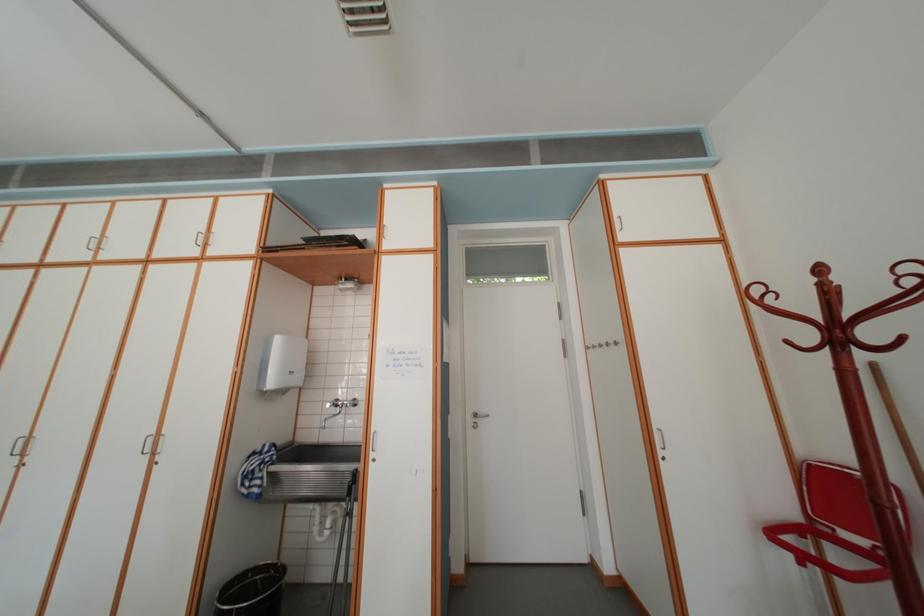
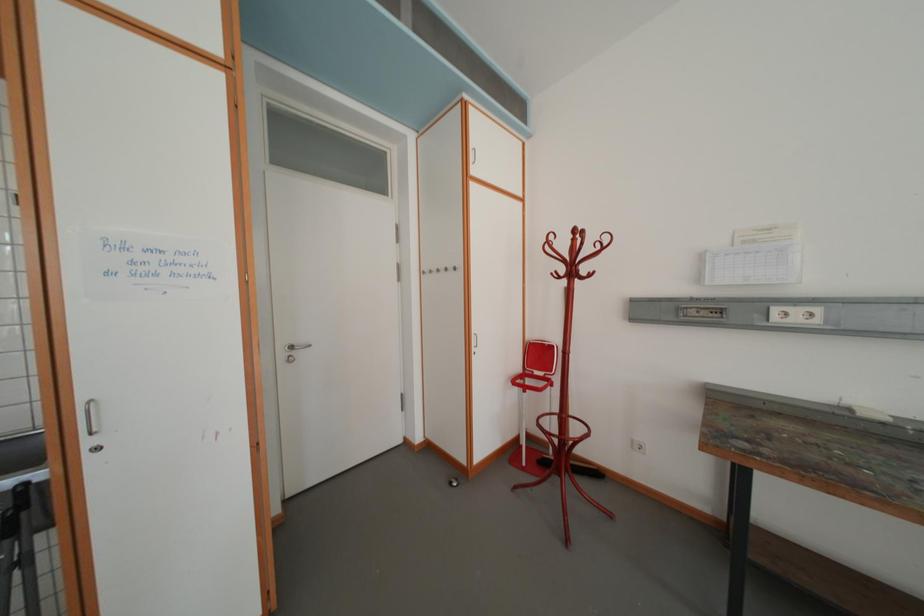
Question: The camera is either moving clockwise (left) or counter-clockwise (right) around the object. The first image is from the beginning of the video and the second image is from the end. Is the camera moving left or right when shooting the video?

Choices:
 (A) Left
 (B) Right

Answer: (A)